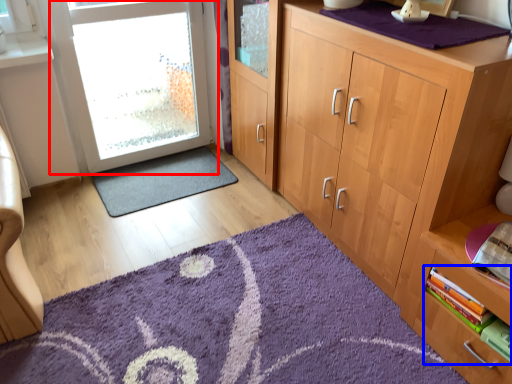
Question: Which object appears farthest to the camera in this image, door (highlighted by a red box) or book (highlighted by a blue box)?

Choices:
 (A) door
 (B) book

Answer: (A)